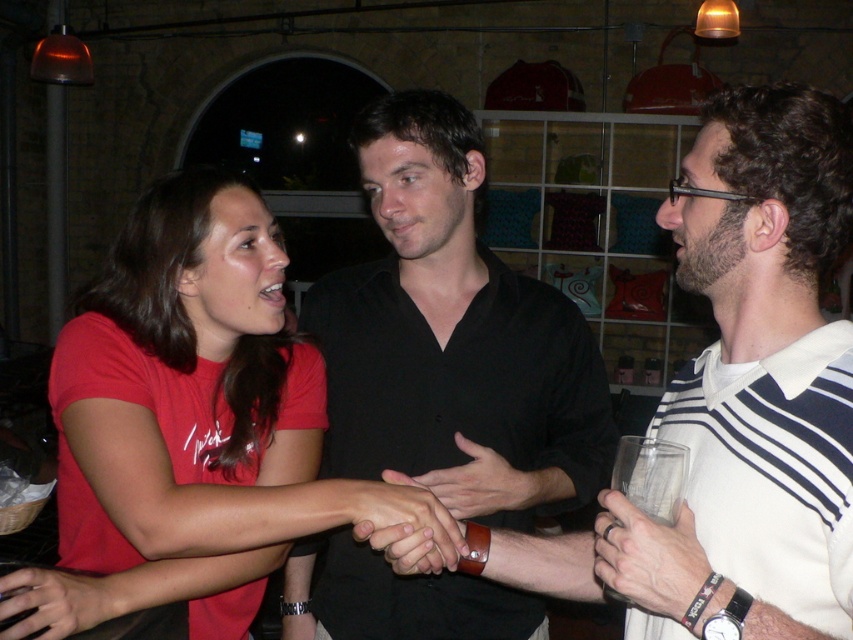
Can you confirm if matte red shirt at lower left is positioned to the right of matte black hand at center?

Incorrect, matte red shirt at lower left is not on the right side of matte black hand at center.

Is matte red shirt at lower left wider than matte black hand at center?

In fact, matte red shirt at lower left might be narrower than matte black hand at center.

Which is in front, point (51, 579) or point (370, 538)?

Positioned in front is point (370, 538).

Find the location of a particular element. The width and height of the screenshot is (853, 640). matte red shirt at lower left is located at coordinates (53, 602).

Between smooth leather wristband at center and matte black hand at center, which one appears on the left side from the viewer's perspective?

Positioned to the left is matte black hand at center.

Who is higher up, smooth leather wristband at center or matte black hand at center?

smooth leather wristband at center is higher up.

I want to click on smooth leather wristband at center, so pyautogui.click(x=480, y=483).

Is the position of black matte shirt at center more distant than that of smooth leather wristband at center?

Yes, black matte shirt at center is further from the viewer.

Is black matte shirt at center taller than smooth leather wristband at center?

Correct, black matte shirt at center is much taller as smooth leather wristband at center.

The height and width of the screenshot is (640, 853). In order to click on black matte shirt at center in this screenshot , I will do `click(453, 339)`.

I want to click on black matte shirt at center, so (x=453, y=339).